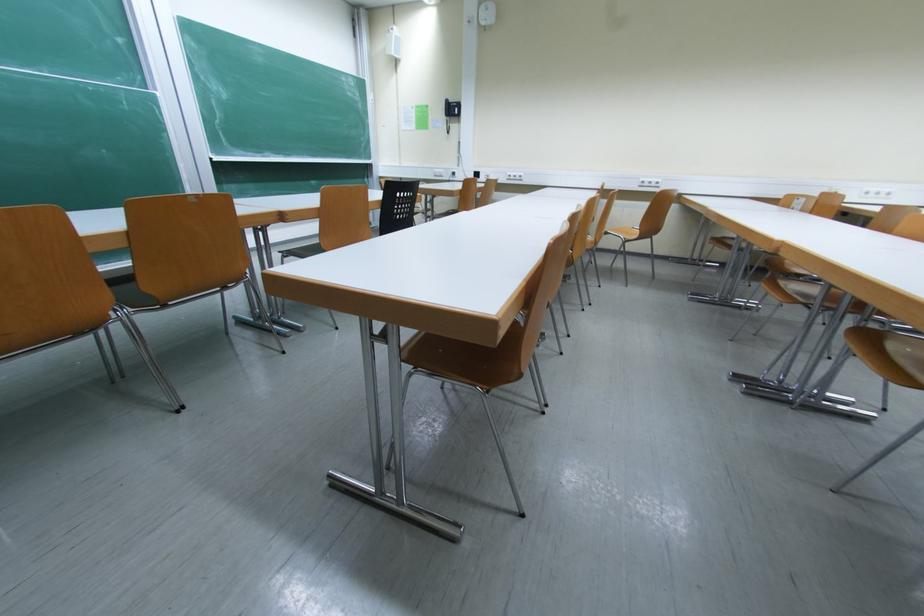
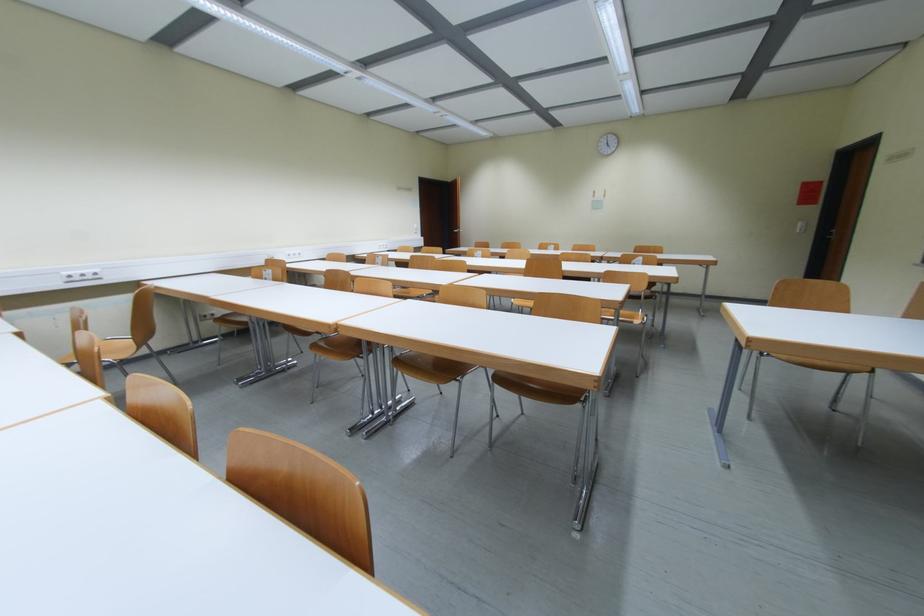
Question: The camera is either moving clockwise (left) or counter-clockwise (right) around the object. The first image is from the beginning of the video and the second image is from the end. Is the camera moving left or right when shooting the video?

Choices:
 (A) Left
 (B) Right

Answer: (A)